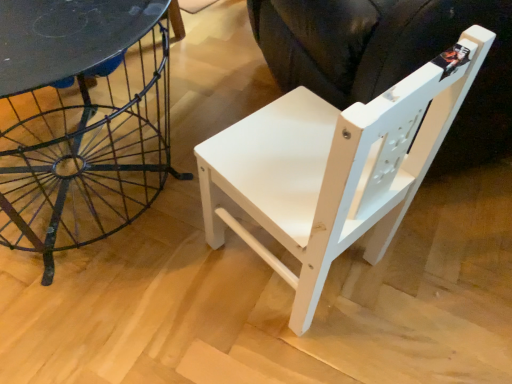
Identify the location of vacant space in front of white matte wood chair at center. (294, 346).